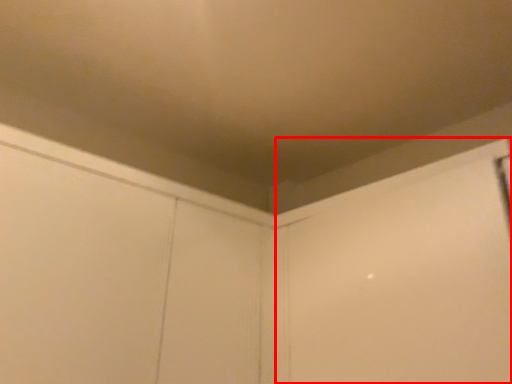
Question: From the image's perspective, considering the relative positions of screen door (annotated by the red box) and screen door in the image provided, where is screen door (annotated by the red box) located with respect to the staircase?

Choices:
 (A) above
 (B) below

Answer: (A)